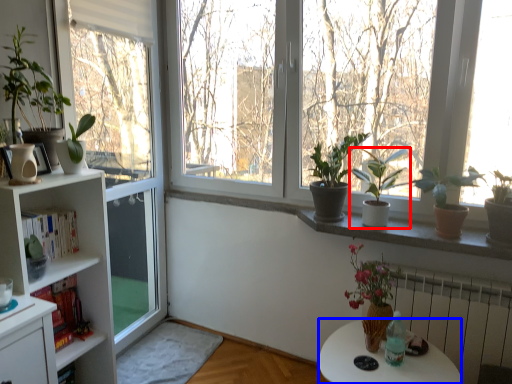
Question: Which object is closer to the camera taking this photo, houseplant (highlighted by a red box) or desk (highlighted by a blue box)?

Choices:
 (A) houseplant
 (B) desk

Answer: (B)